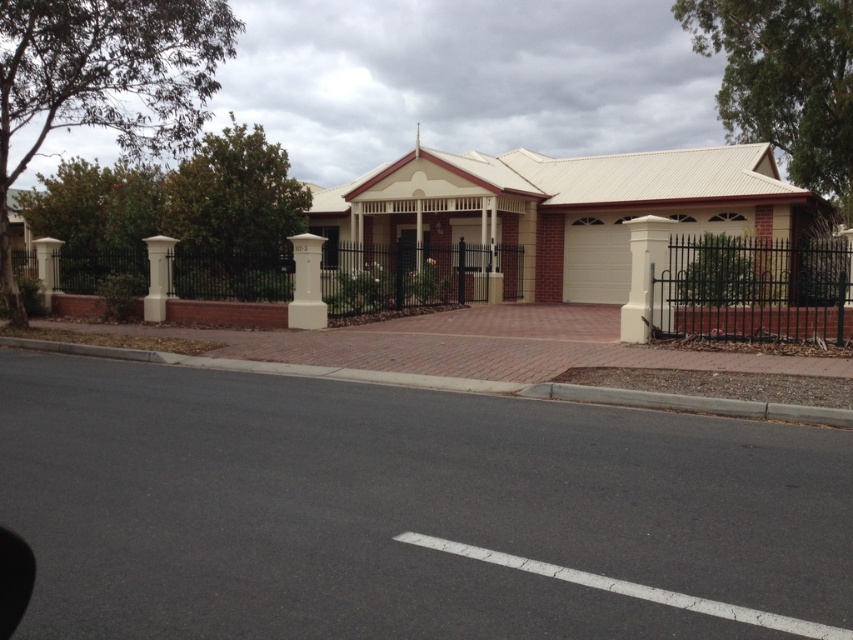
You are a delivery person approaching the house and need to park your vehicle between the white smooth post at left and the white smooth pillar at left. Can you fit your vehicle between them?

The white smooth post at left occupies less space than the white smooth pillar at left, so there might be enough space to park between them, but the exact width isn